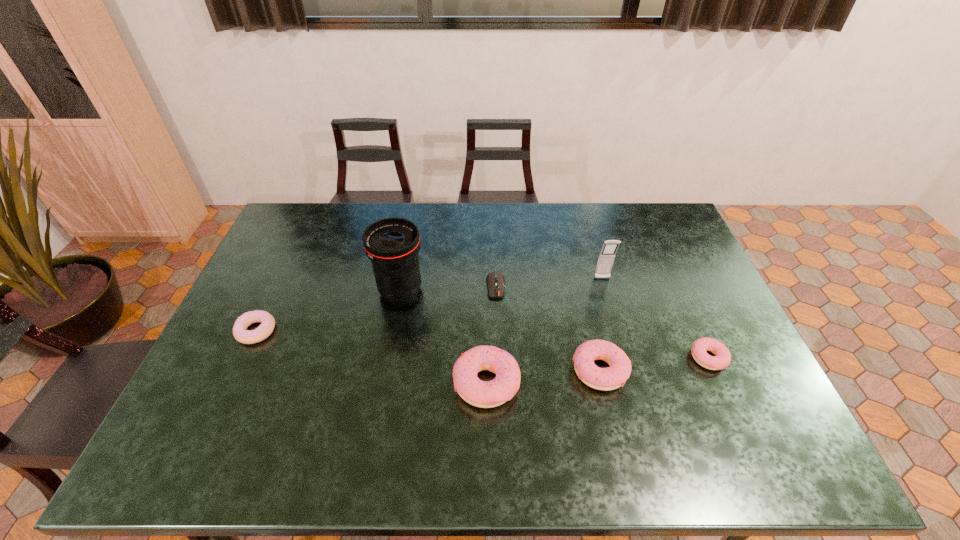
This screenshot has height=540, width=960. Identify the location of blank space at the near edge of the desktop. (587, 406).

Image resolution: width=960 pixels, height=540 pixels. Identify the location of blank space at the left edge. (223, 367).

I want to click on vacant space at the right edge of the desktop, so click(x=733, y=356).

This screenshot has height=540, width=960. In the image, there is a desktop. Identify the location of vacant space at the far left corner. (275, 242).

Locate an element on the screen. vacant space at the near left corner of the desktop is located at coordinates (251, 404).

This screenshot has width=960, height=540. Find the location of `vacant space at the far right corner`. vacant space at the far right corner is located at coordinates (673, 220).

The height and width of the screenshot is (540, 960). I want to click on unoccupied area between the rightmost doughnut and the computer equipment, so click(x=602, y=322).

Locate an element on the screen. The height and width of the screenshot is (540, 960). vacant point located between the sixth object from right to left and the shortest doughnut is located at coordinates (554, 324).

Where is `free spot between the leftmost doughnut and the cellular telephone`? The height and width of the screenshot is (540, 960). free spot between the leftmost doughnut and the cellular telephone is located at coordinates (429, 305).

I want to click on vacant point located between the computer equipment and the third shortest doughnut, so click(548, 328).